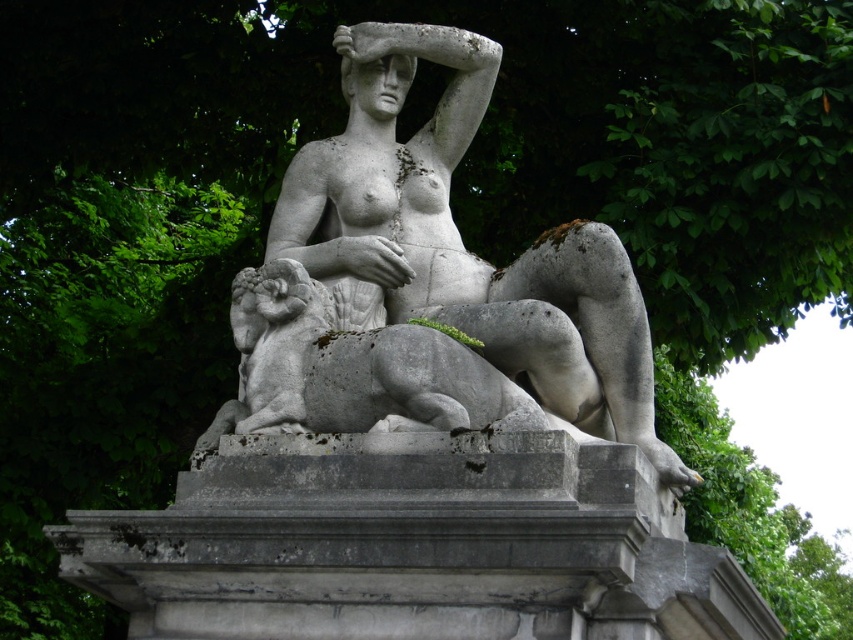
Question: Which of the following is the closest to the observer?

Choices:
 (A) gray stone statue at center
 (B) white stone statue at center

Answer: (A)

Question: Which point is farther to the camera?

Choices:
 (A) (334, 38)
 (B) (372, 417)

Answer: (A)

Question: Does gray stone statue at center come in front of gray stone lion at center?

Choices:
 (A) no
 (B) yes

Answer: (A)

Question: Is white stone statue at center positioned in front of gray stone lion at center?

Choices:
 (A) yes
 (B) no

Answer: (B)

Question: Which point appears farthest from the camera in this image?

Choices:
 (A) (370, 100)
 (B) (520, 256)
 (C) (405, 362)

Answer: (B)

Question: Where is gray stone statue at center located in relation to white stone statue at center in the image?

Choices:
 (A) above
 (B) below

Answer: (B)